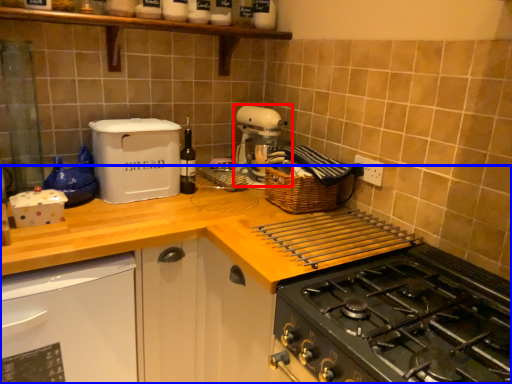
Question: Which of the following is the farthest to the observer, mixer (highlighted by a red box) or countertop (highlighted by a blue box)?

Choices:
 (A) mixer
 (B) countertop

Answer: (A)